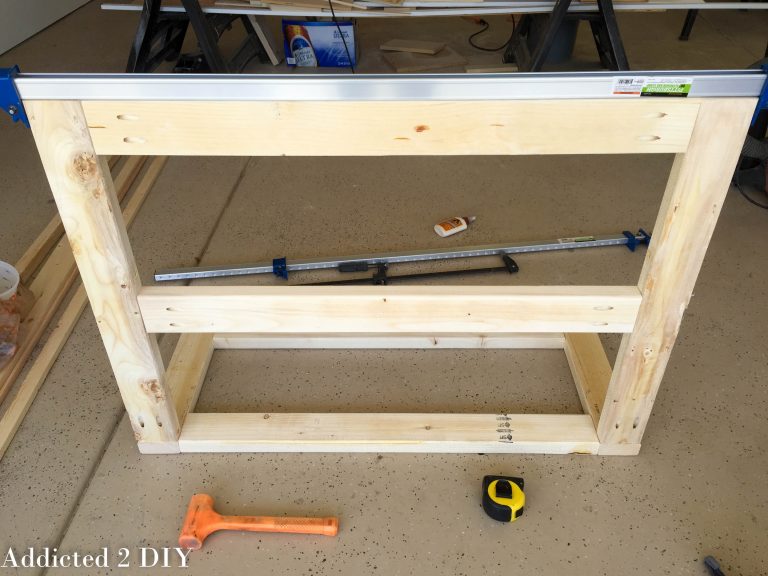
Identify the location of white plastic bin. (7, 285).